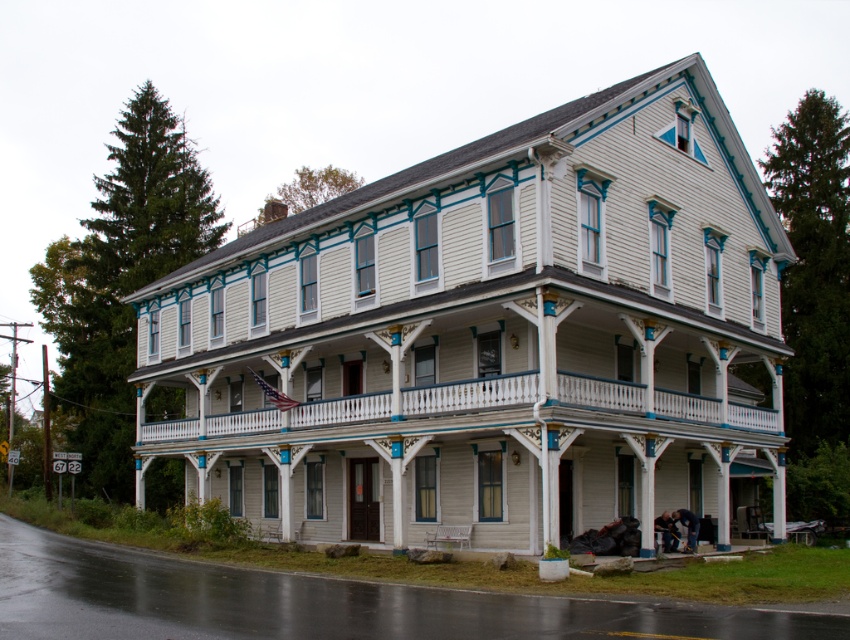
Does white wood building at center have a lesser width compared to white painted wood porch at center?

In fact, white wood building at center might be wider than white painted wood porch at center.

Based on the photo, does white wood building at center appear on the right side of white painted wood porch at center?

In fact, white wood building at center is to the left of white painted wood porch at center.

The height and width of the screenshot is (640, 850). In order to click on white wood building at center in this screenshot , I will do `click(488, 336)`.